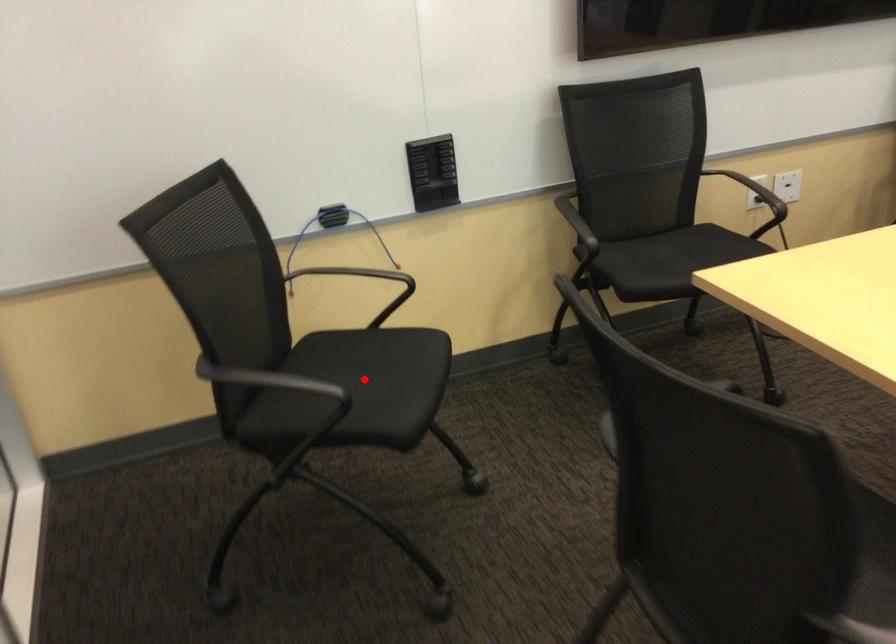
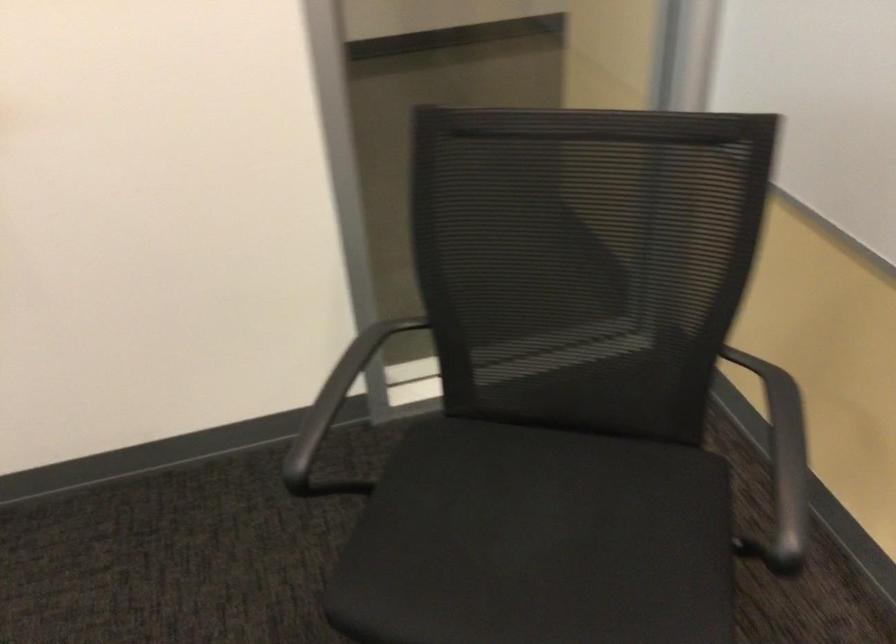
Question: I am providing you with two images of the same scene from different viewpoints. In image1, a red point is highlighted. Considering the same 3D point in image2, which of the following is correct?

Choices:
 (A) It is closer
 (B) It is farther

Answer: (A)